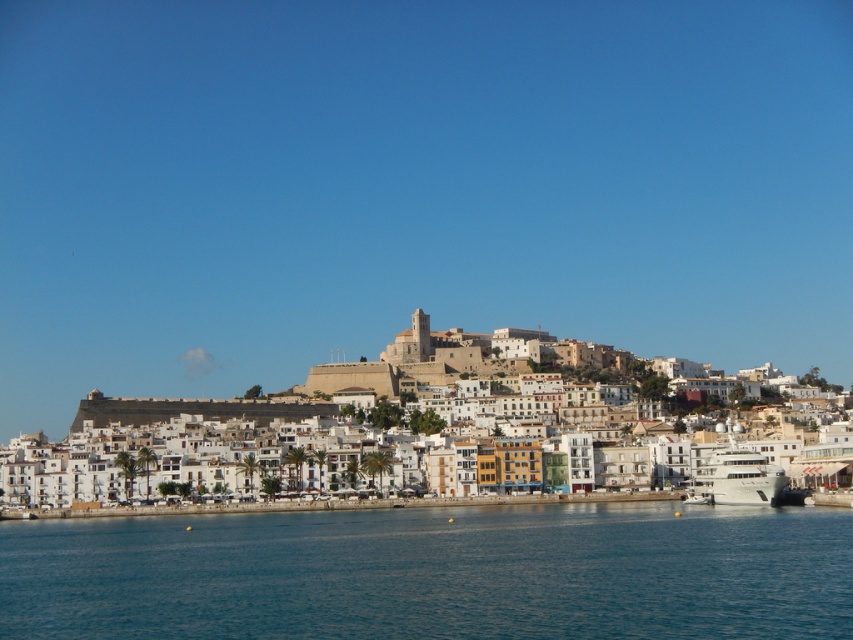
Is white matte buildings at center behind white glossy yacht at lower right?

That is True.

Does white matte buildings at center appear under white glossy yacht at lower right?

No.

Where is `white matte buildings at center`? This screenshot has height=640, width=853. white matte buildings at center is located at coordinates (173, 436).

Which is above, blue water at lower center or white glossy yacht at lower right?

white glossy yacht at lower right is higher up.

Does blue water at lower center appear on the left side of white glossy yacht at lower right?

Indeed, blue water at lower center is positioned on the left side of white glossy yacht at lower right.

Which is behind, point (671, 579) or point (773, 474)?

Point (773, 474)

The height and width of the screenshot is (640, 853). Find the location of `blue water at lower center`. blue water at lower center is located at coordinates (434, 573).

Is the position of blue water at lower center more distant than that of white matte buildings at center?

No, blue water at lower center is in front of white matte buildings at center.

Between point (711, 518) and point (556, 397), which one is positioned behind?

The point (556, 397) is more distant.

Is point (518, 563) more distant than point (325, 365)?

No, it is not.

Identify the location of blue water at lower center. (434, 573).